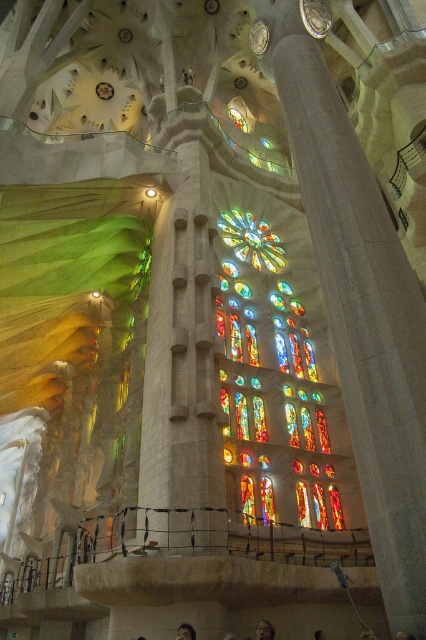
You are an architect visiting the cathedral and notice the smooth stone pillar at center and the dark brown hair at lower center. Based on their heights, which object would require a taller ladder to reach its top?

The smooth stone pillar at center has a greater height compared to the dark brown hair at lower center, so a taller ladder would be needed to reach its top.